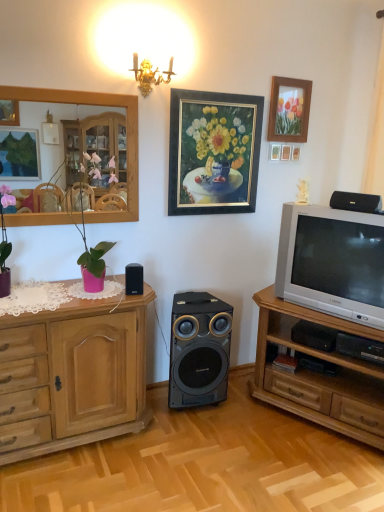
Locate an element on the screen. Image resolution: width=384 pixels, height=512 pixels. blank space above gold-framed painting at upper center, which is counted as the first picture frame, starting from the left (from a real-world perspective) is located at coordinates (221, 92).